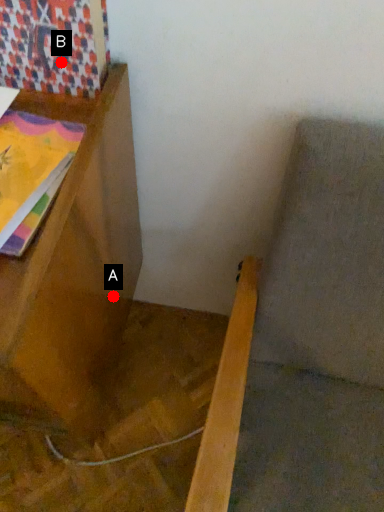
Question: Two points are circled on the image, labeled by A and B beside each circle. Which point is closer to the camera taking this photo?

Choices:
 (A) A is closer
 (B) B is closer

Answer: (B)